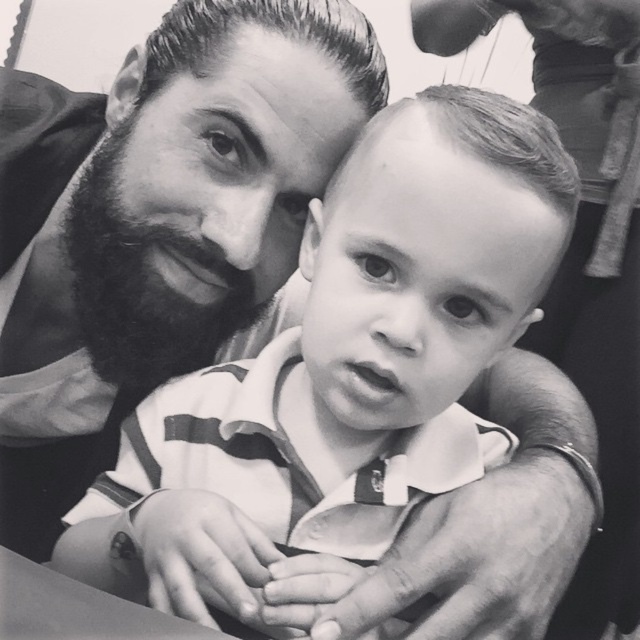
You are an observer looking at the photograph. You notice the matte black shirt at center and the smooth hair at center. Which object is positioned in front of the other?

The matte black shirt at center is closer to the viewer than the smooth hair at center, so the matte black shirt at center is positioned in front of the smooth hair at center.